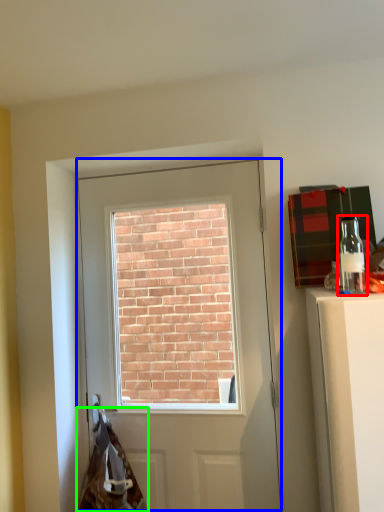
Question: Which object is positioned closest to bottle (highlighted by a red box)? Select from door (highlighted by a blue box) and material (highlighted by a green box).

Choices:
 (A) door
 (B) material

Answer: (A)